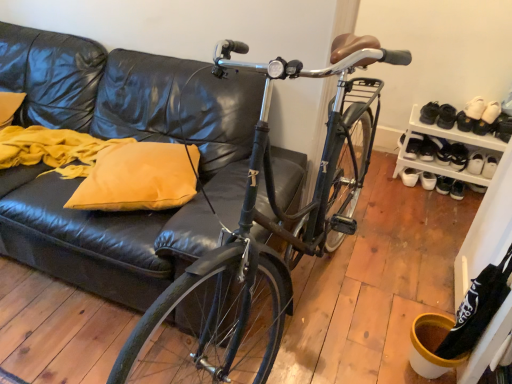
Find the location of a particular element. The height and width of the screenshot is (384, 512). free space to the left of white matte sneakers at lower right, which ranks as the 2th footwear in left-to-right order is located at coordinates (380, 173).